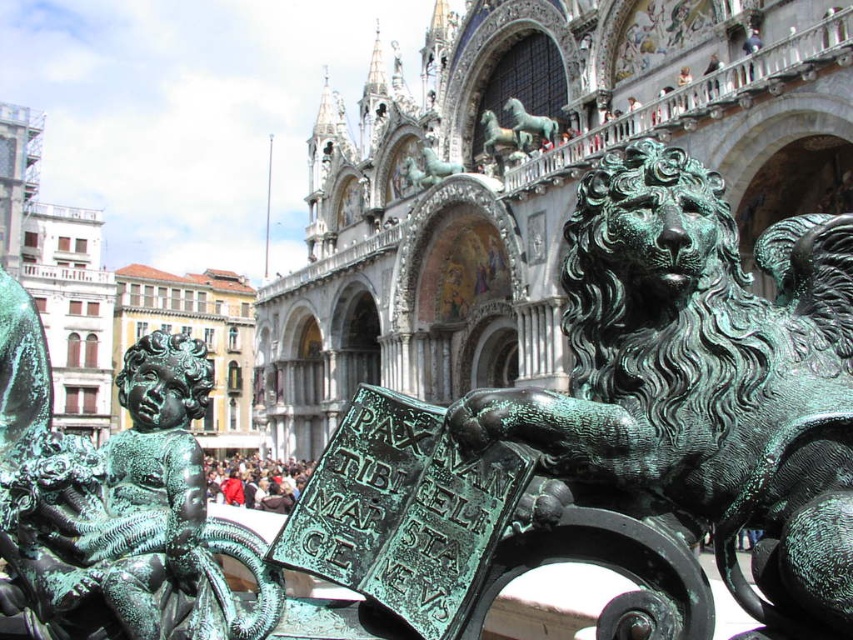
You are an art conservator examining the bronze sculpture in the public square. You notice a specific point on the sculpture marked at coordinates (704, 378). Based on the scene description, what object or feature is located at that point?

The point at coordinates (704, 378) indicates the green patina lion at center.

Looking at this image, you are standing in front of the bronze sculpture and want to take a photo that includes both the lion and the book. The lion is at point (637, 259) and the book is at point (38, 541). Which point is closer to your camera lens?

Point (637, 259) is closer to the camera than point (38, 541).